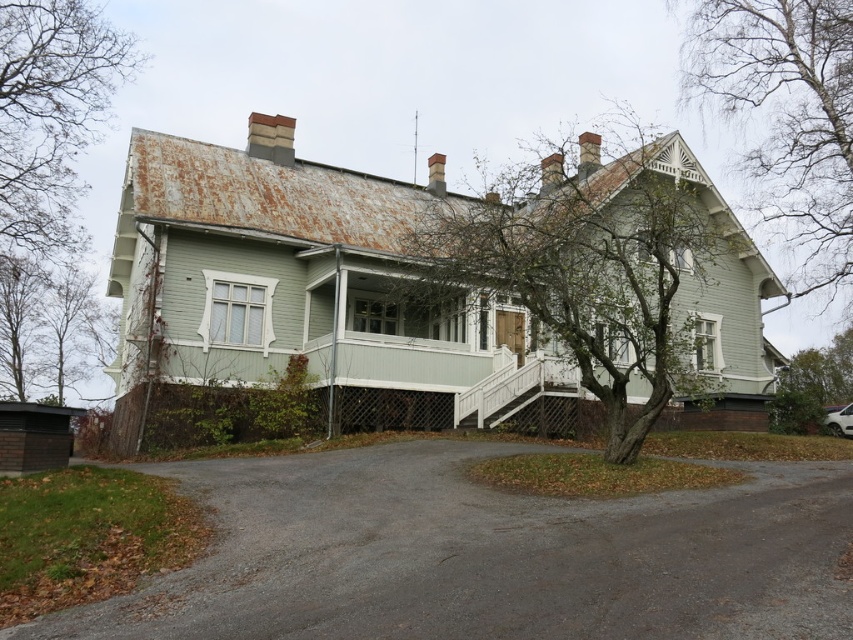
Question: Can you confirm if green wood tree at center is smaller than green wood tree at left?

Choices:
 (A) no
 (B) yes

Answer: (B)

Question: Considering the real-world distances, which object is farthest from the green wood tree at center?

Choices:
 (A) green wood tree at left
 (B) gray asphalt driveway at lower center
 (C) green wood tree at right
 (D) bare branches at upper right

Answer: (A)

Question: Considering the relative positions of green wood tree at left and green wood tree at right in the image provided, where is green wood tree at left located with respect to green wood tree at right?

Choices:
 (A) right
 (B) left

Answer: (B)

Question: Which object appears farthest from the camera in this image?

Choices:
 (A) green wood tree at left
 (B) green wood tree at center
 (C) gray asphalt driveway at lower center

Answer: (A)

Question: Which point appears closest to the camera in this image?

Choices:
 (A) (735, 243)
 (B) (827, 372)
 (C) (0, 224)
 (D) (746, 104)

Answer: (A)

Question: Is bare branches at upper right closer to camera compared to green wood tree at right?

Choices:
 (A) no
 (B) yes

Answer: (A)